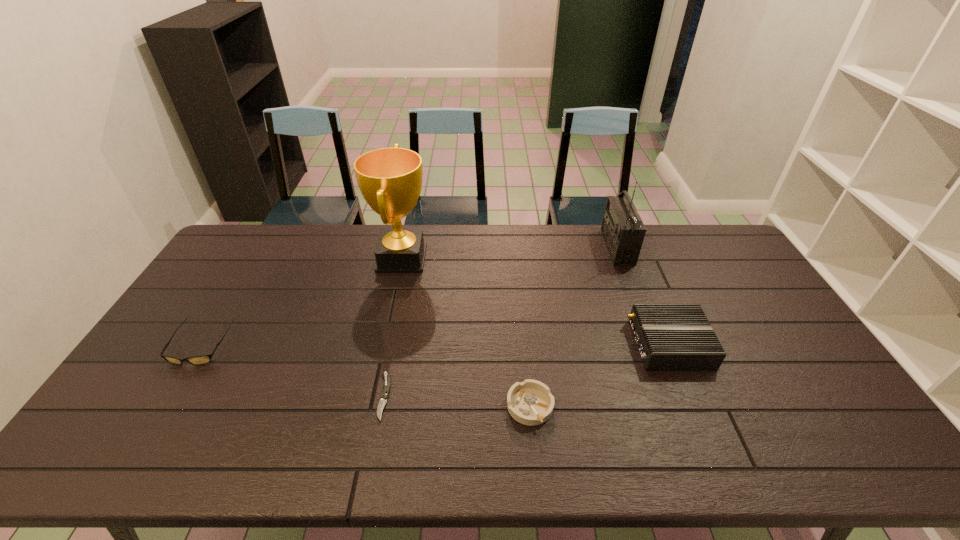
Image resolution: width=960 pixels, height=540 pixels. In order to click on object that is at the left edge in this screenshot , I will do `click(199, 359)`.

Identify the location of vacant area at the far edge of the desktop. (522, 241).

I want to click on free location at the near edge of the desktop, so click(x=801, y=457).

In the image, there is a desktop. In order to click on vacant space at the left edge in this screenshot , I will do `click(249, 281)`.

Find the location of a particular element. vacant space at the right edge of the desktop is located at coordinates (788, 354).

In order to click on vacant space at the far left corner in this screenshot , I will do `click(232, 258)`.

I want to click on free region at the near left corner of the desktop, so click(x=146, y=458).

At what (x,y) coordinates should I click in order to perform the action: click on vacant point located between the radio receiver and the third tallest object. Please return your answer as a coordinate pair (x, y). This screenshot has height=540, width=960. Looking at the image, I should click on (643, 296).

Locate an element on the screen. This screenshot has height=540, width=960. free space between the leftmost object and the award is located at coordinates pos(301,301).

The image size is (960, 540). What are the coordinates of `vacant space that is in between the ashtray and the sunglasses` in the screenshot? It's located at (366, 376).